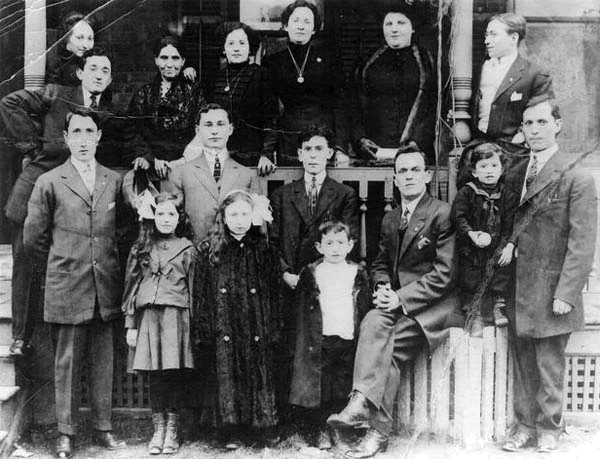
What are the coordinates of `pillar` in the screenshot? It's located at (458, 52), (32, 66).